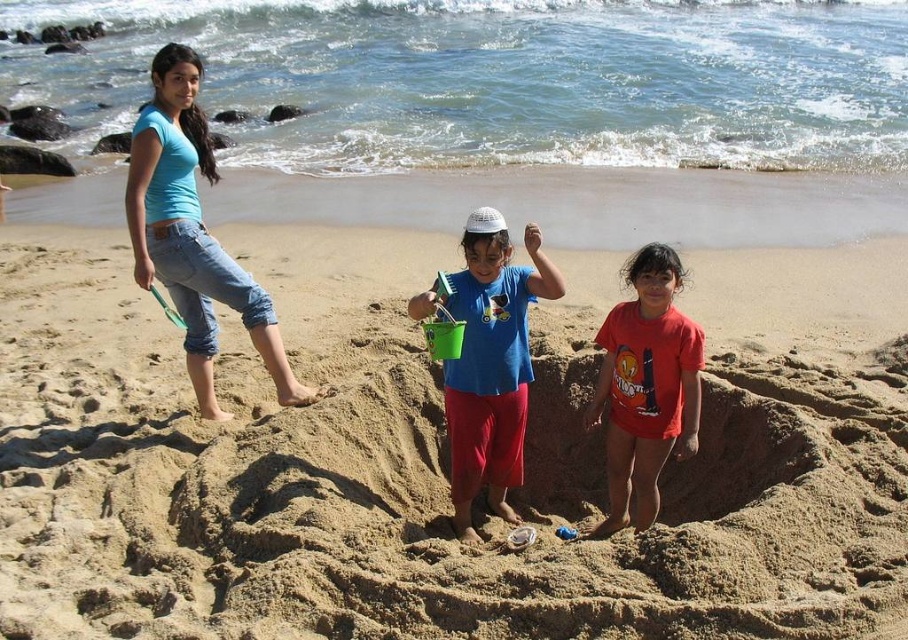
You are a photographer standing at the edge of the beach. You want to take a photo of the beige sand at center and the red cotton shirt at center. Which object will appear larger in the photo?

The beige sand at center is taller than the red cotton shirt at center, so it will appear larger in the photo.

You are a sandcastle builder and need to know where the beige sand at center is located. Can you determine its position based on the coordinates provided?

The beige sand at center is located at point coordinates (430, 460).